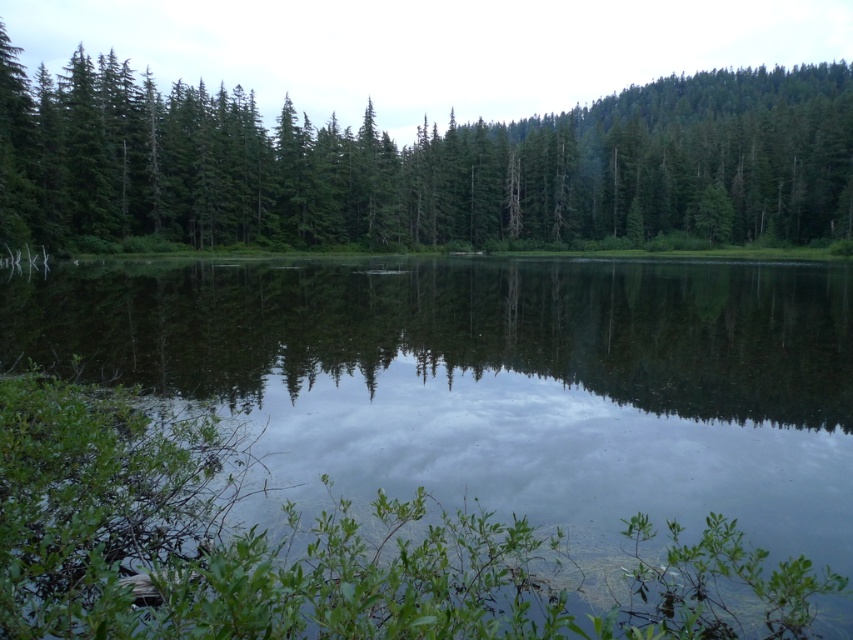
Does transparent water at center lie in front of green matte trees at upper center?

Yes, it is in front of green matte trees at upper center.

Between transparent water at center and green matte trees at upper center, which one appears on the left side from the viewer's perspective?

transparent water at center is more to the left.

Between point (811, 483) and point (647, 150), which one is positioned behind?

Point (647, 150)

Locate an element on the screen. This screenshot has width=853, height=640. transparent water at center is located at coordinates (503, 378).